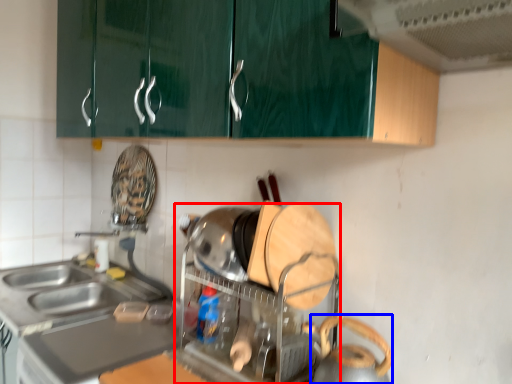
Question: Among these objects, which one is farthest to the camera, appliance (highlighted by a red box) or appliance (highlighted by a blue box)?

Choices:
 (A) appliance
 (B) appliance

Answer: (A)